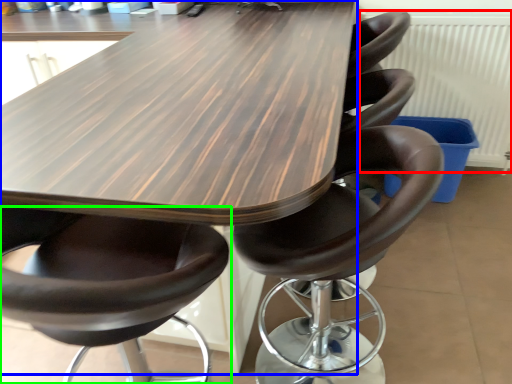
Question: Estimate the real-world distances between objects in this image. Which object is farther from radiator (highlighted by a red box), table (highlighted by a blue box) or chair (highlighted by a green box)?

Choices:
 (A) table
 (B) chair

Answer: (B)